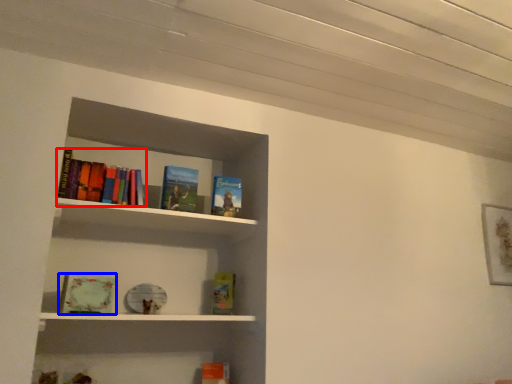
Question: Which point is closer to the camera, book (highlighted by a red box) or book (highlighted by a blue box)?

Choices:
 (A) book
 (B) book

Answer: (B)